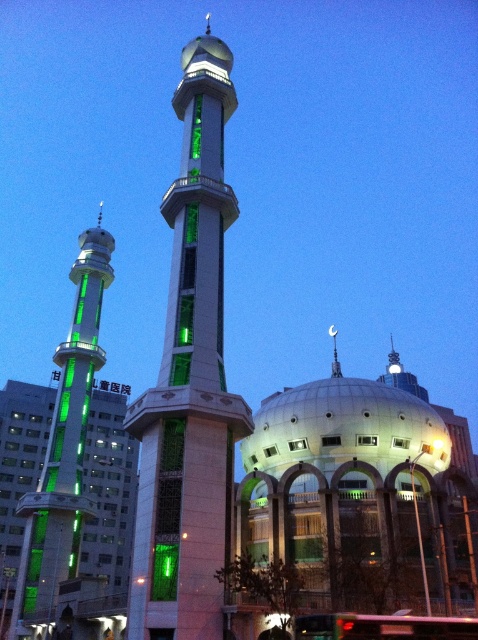
Does point (173, 522) lie behind point (76, 484)?

No, it is not.

Between green glass minaret at center and green glass minaret at left, which one is positioned higher?

green glass minaret at center is above.

Image resolution: width=478 pixels, height=640 pixels. What are the coordinates of `green glass minaret at center` in the screenshot? It's located at (189, 381).

This screenshot has height=640, width=478. Find the location of `green glass minaret at center`. green glass minaret at center is located at coordinates (189, 381).